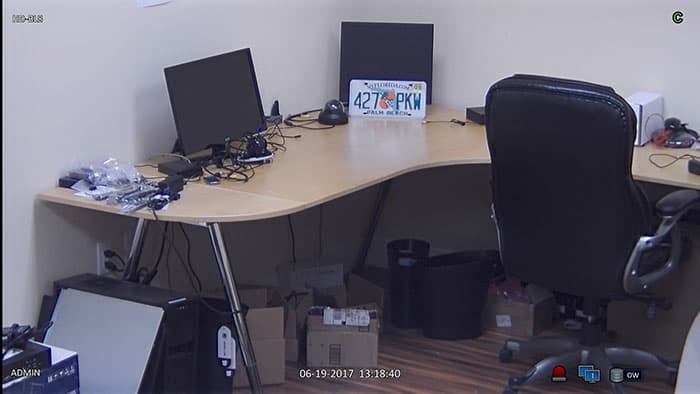
This screenshot has width=700, height=394. I want to click on floor, so click(x=447, y=356).